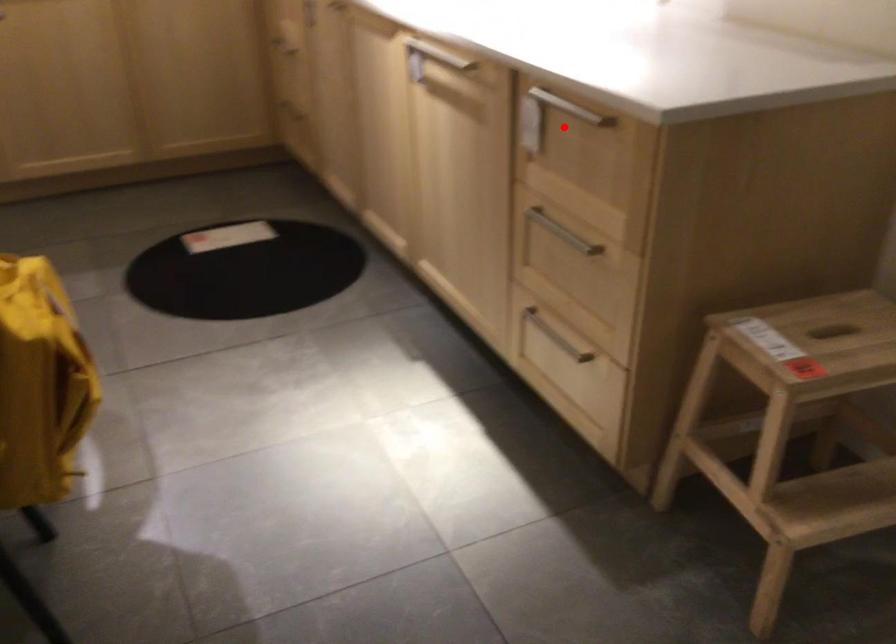
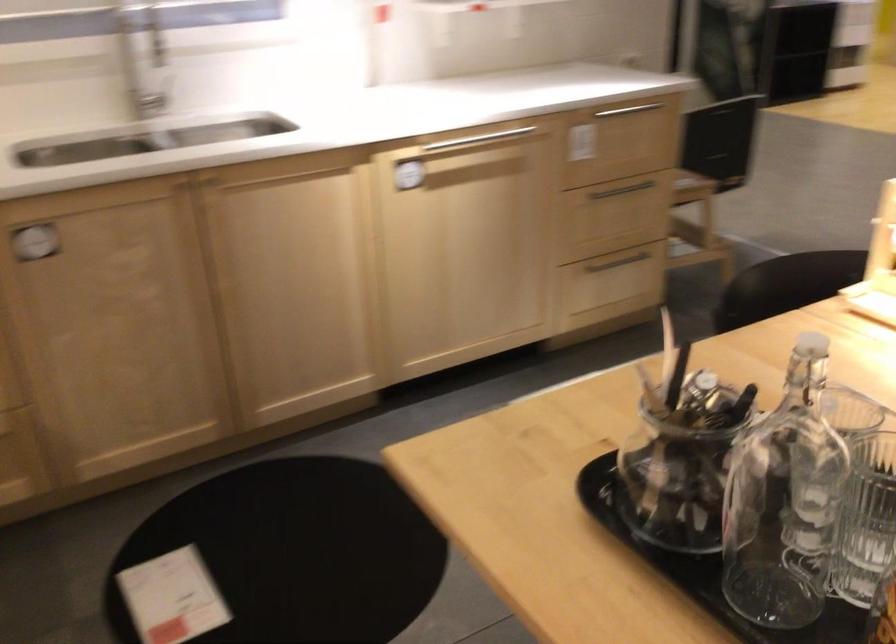
Question: I am providing you with two images of the same scene from different viewpoints. Given a red point in image1, look at the same physical point in image2. Is it:

Choices:
 (A) Closer to the viewpoint
 (B) Farther from the viewpoint

Answer: (B)